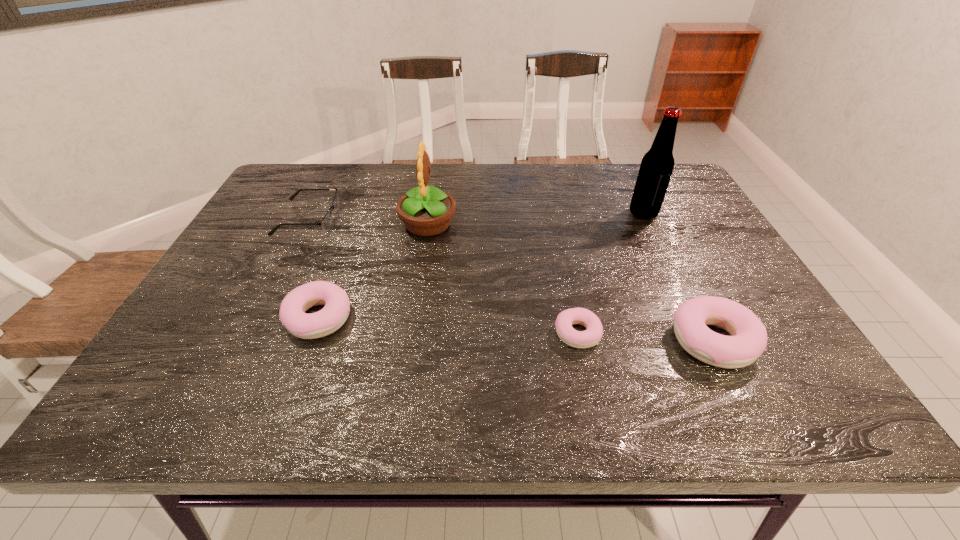
At what (x,y) coordinates should I click in order to perform the action: click on the second tallest pastry. Please return your answer as a coordinate pair (x, y). Looking at the image, I should click on (292, 314).

Where is `the third shortest object`? This screenshot has width=960, height=540. the third shortest object is located at coordinates (292, 314).

Where is `the shortest object`? This screenshot has width=960, height=540. the shortest object is located at coordinates pos(579,339).

Where is `the fourth object from left to right`? the fourth object from left to right is located at coordinates (579, 339).

The width and height of the screenshot is (960, 540). Find the location of `the rightmost pastry`. the rightmost pastry is located at coordinates (748, 340).

Where is `the tallest object`? The width and height of the screenshot is (960, 540). the tallest object is located at coordinates (656, 168).

The width and height of the screenshot is (960, 540). In order to click on the second shortest object in this screenshot , I will do `click(326, 222)`.

Where is `the fourth object from right to left`? The image size is (960, 540). the fourth object from right to left is located at coordinates (425, 211).

What are the coordinates of `the fifth shortest object` in the screenshot? It's located at (425, 211).

At what (x,y) coordinates should I click in order to perform the action: click on free space located 0.200m on the back of the fourth tallest object. Please return your answer as a coordinate pair (x, y). The image size is (960, 540). Looking at the image, I should click on (348, 241).